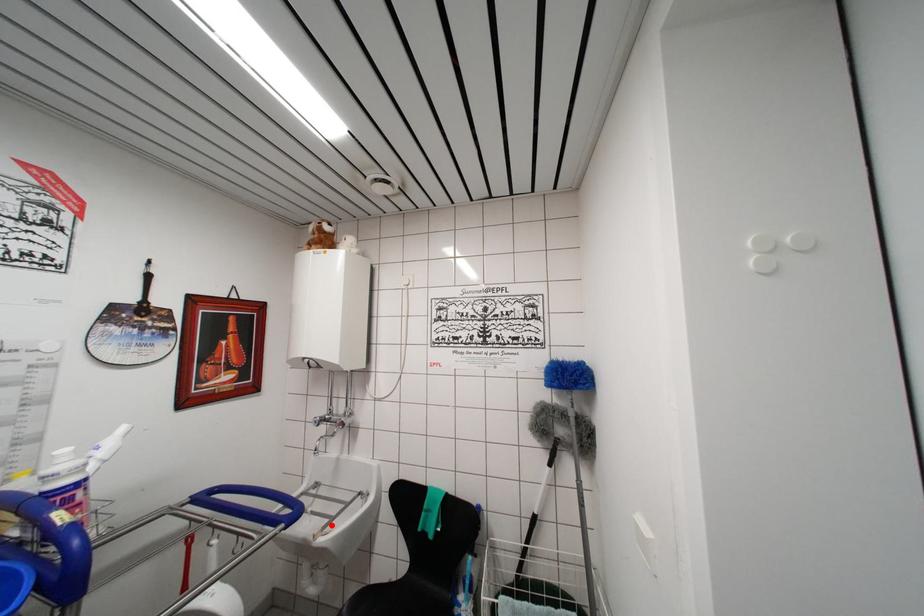
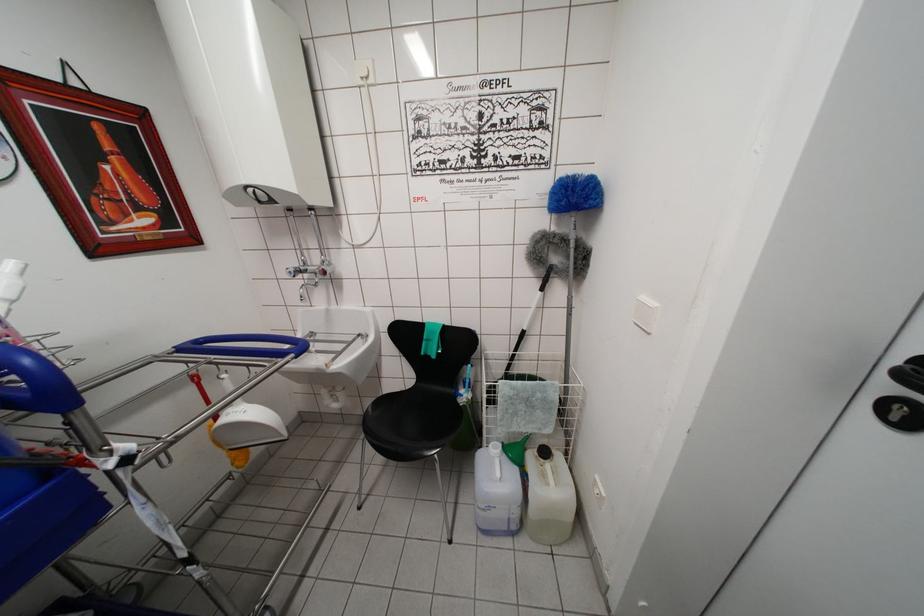
Where in the second image is the point corresponding to the highlighted location from the first image?

(338, 360)